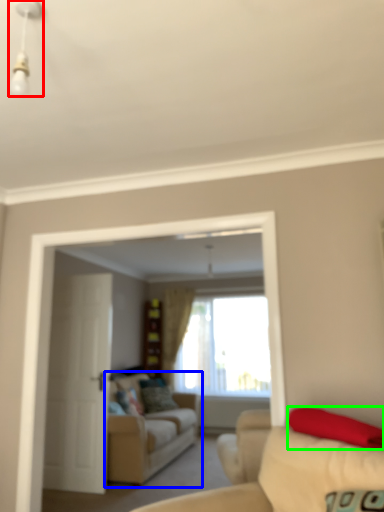
Question: Considering the real-world distances, which object is closest to light fixture (highlighted by a red box)? studio couch (highlighted by a blue box) or pillow (highlighted by a green box).

Choices:
 (A) studio couch
 (B) pillow

Answer: (B)